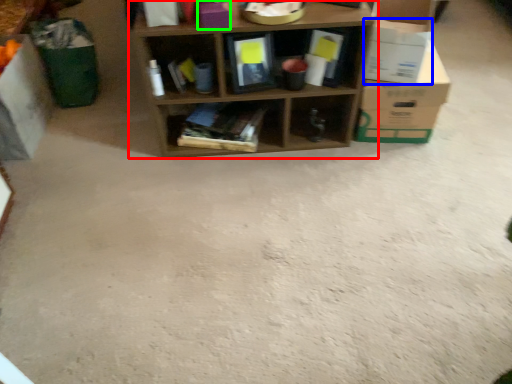
Question: Considering the real-world distances, which object is farthest from shelf (highlighted by a red box)? cardboard box (highlighted by a blue box) or storage box (highlighted by a green box)?

Choices:
 (A) cardboard box
 (B) storage box

Answer: (B)